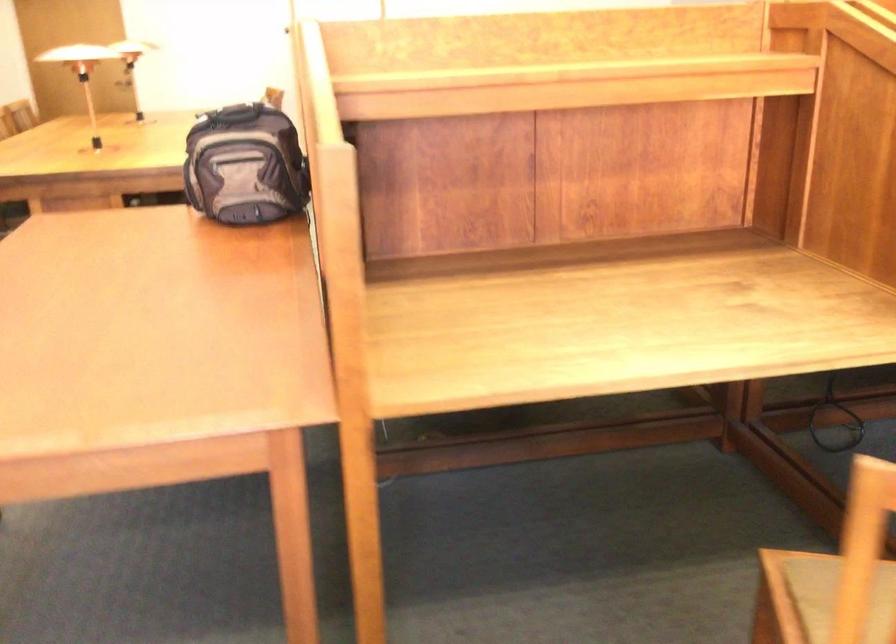
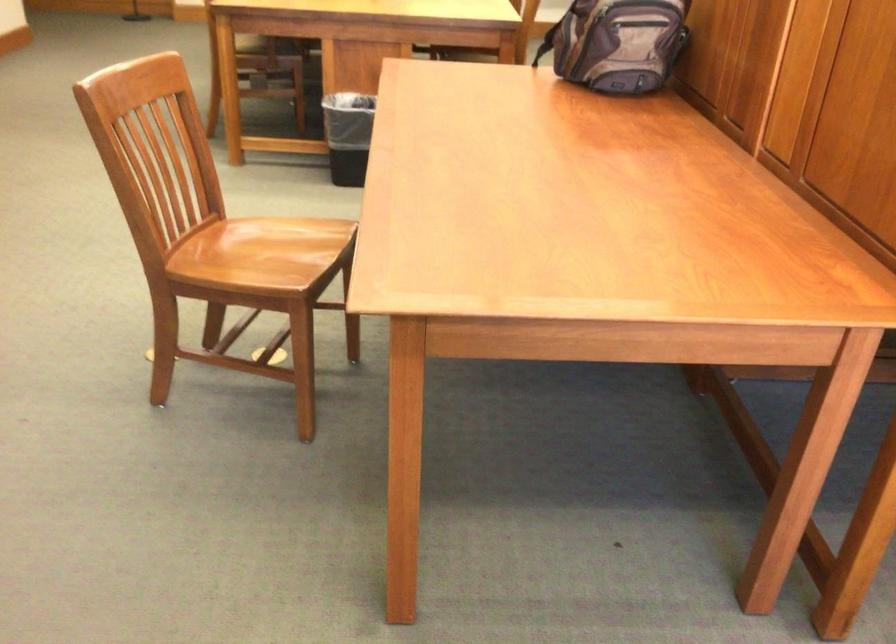
Locate, in the second image, the point that corresponds to the point at 192,158 in the first image.

(582, 15)